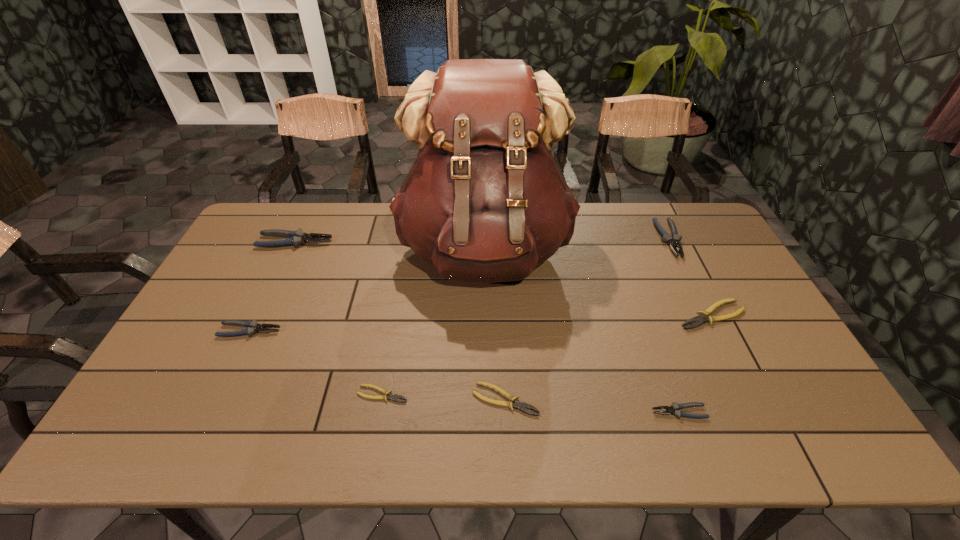
Locate an element on the screen. The image size is (960, 540). vacant space located 0.230m at the gripping part of the smallest gray pliers is located at coordinates (556, 412).

Find the location of a particular element. vacant space located at the gripping part of the smallest gray pliers is located at coordinates (581, 412).

The height and width of the screenshot is (540, 960). Identify the location of vacant region located at the gripping part of the smallest gray pliers. (564, 412).

The image size is (960, 540). Find the location of `vacant space situated 0.110m on the right of the second yellow pliers from right to left`. vacant space situated 0.110m on the right of the second yellow pliers from right to left is located at coordinates (583, 399).

I want to click on free spot located 0.270m on the right of the shortest object, so click(x=517, y=394).

Find the location of a particular element. satchel that is positioned at the far edge is located at coordinates [484, 202].

Identify the location of object that is at the far left corner. (295, 238).

Where is `object that is at the far right corner`? object that is at the far right corner is located at coordinates (673, 241).

In the image, there is a desktop. Where is `vacant space at the far edge`? Image resolution: width=960 pixels, height=540 pixels. vacant space at the far edge is located at coordinates (617, 205).

Locate an element on the screen. This screenshot has width=960, height=540. vacant area at the left edge of the desktop is located at coordinates (205, 315).